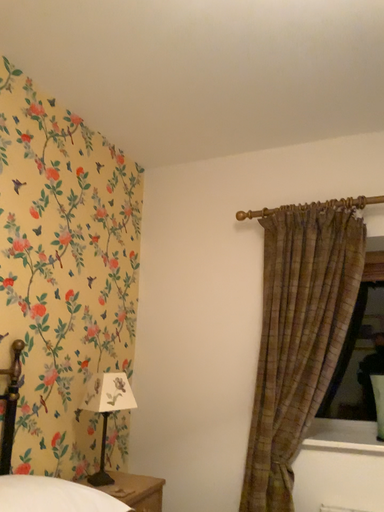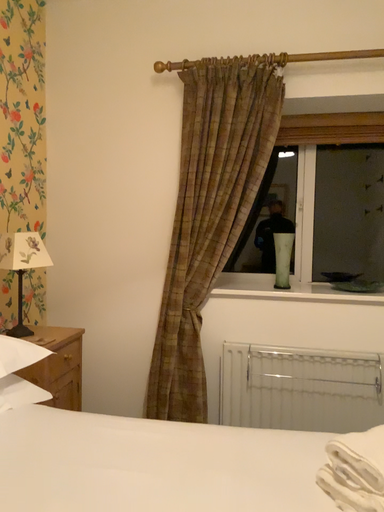
Question: How did the camera likely rotate when shooting the video?

Choices:
 (A) rotated downward
 (B) rotated upward

Answer: (A)